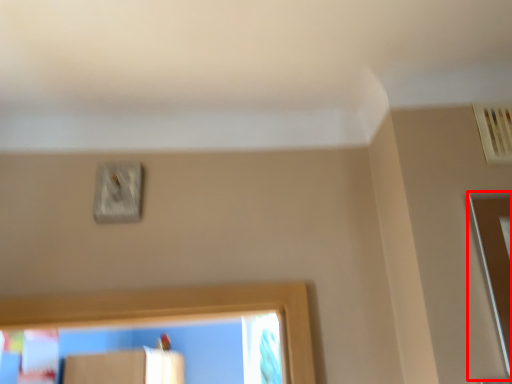
Question: From the image's perspective, considering the relative positions of screen door (annotated by the red box) and light switch in the image provided, where is screen door (annotated by the red box) located with respect to the staircase?

Choices:
 (A) above
 (B) below

Answer: (B)